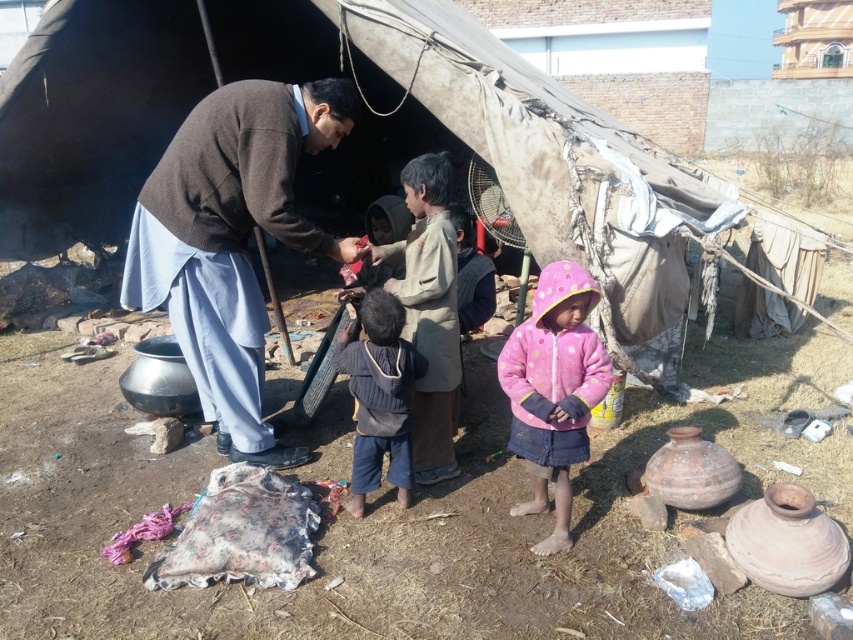
You are a photographer standing at a distance and want to capture both the rough canvas tent at center and the dark blue knitted sweater at center in your photo. Which object should you focus on first to ensure both are in sharp focus?

You should focus on the rough canvas tent at center first because it is closer to you than the dark blue knitted sweater at center, so focusing on the closer object will help both be in focus.

You are trying to decide which sweater to take for a cold day. Both the brown wool sweater at center and the dark blue knitted sweater at center are available. Based on their sizes, which one might provide more warmth and coverage?

The brown wool sweater at center might be wider than the dark blue knitted sweater at center, so it could provide more warmth and coverage due to its potentially larger size.

You are standing in front of the makeshift shelter and want to determine which of the two points, point (166, 308) or point (378, 417), is closer to you. Based on the coordinates provided, which point is nearer?

Point (166, 308) is closer to you because it is further to the viewer than point (378, 417).